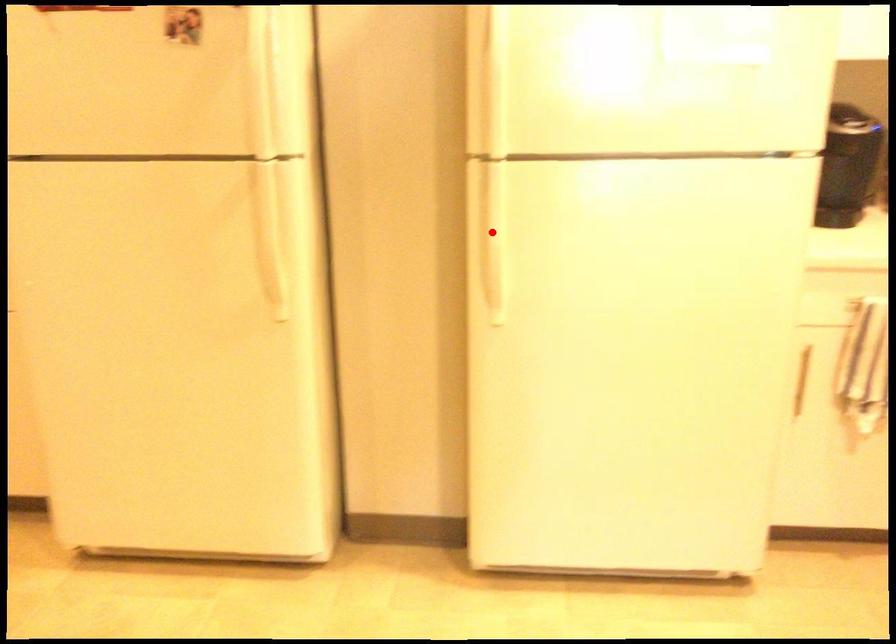
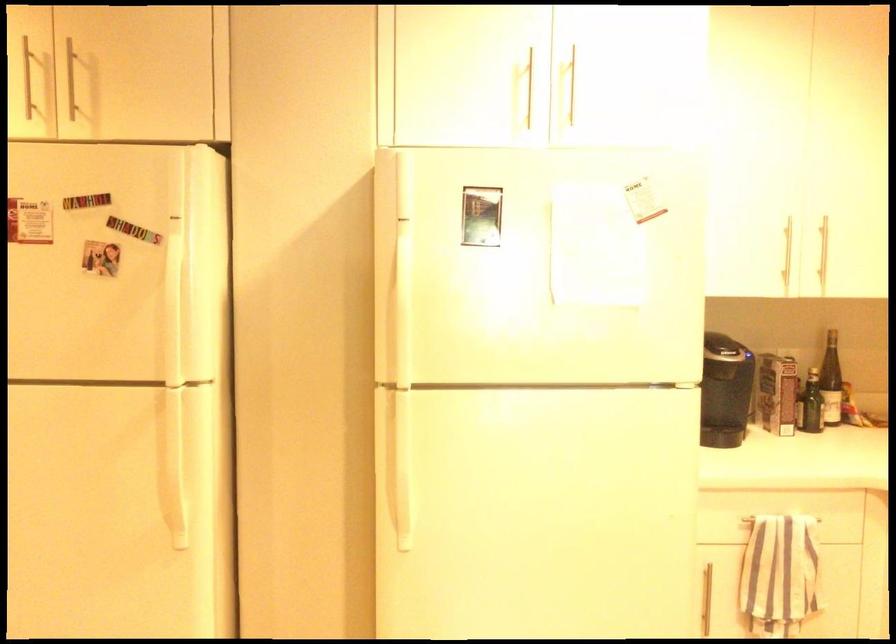
The point at the highlighted location is marked in the first image. Where is the corresponding point in the second image?

(398, 460)